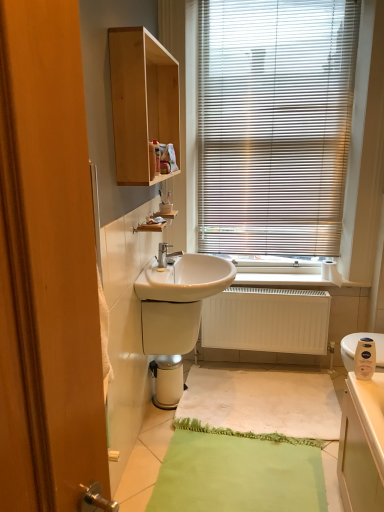
Question: Is matte plastic soap dispenser at lower right facing away from wooden cabinet at left?

Choices:
 (A) yes
 (B) no

Answer: (B)

Question: Is matte plastic soap dispenser at lower right far away from wooden cabinet at left?

Choices:
 (A) yes
 (B) no

Answer: (A)

Question: Does matte plastic soap dispenser at lower right appear on the left side of wooden cabinet at left?

Choices:
 (A) no
 (B) yes

Answer: (A)

Question: From a real-world perspective, is matte plastic soap dispenser at lower right on top of wooden cabinet at left?

Choices:
 (A) no
 (B) yes

Answer: (A)

Question: Does matte plastic soap dispenser at lower right have a greater height compared to wooden cabinet at left?

Choices:
 (A) yes
 (B) no

Answer: (B)

Question: Is matte plastic soap dispenser at lower right bigger or smaller than white matte radiator at lower center?

Choices:
 (A) big
 (B) small

Answer: (B)

Question: In the image, is matte plastic soap dispenser at lower right on the left side or the right side of white matte radiator at lower center?

Choices:
 (A) left
 (B) right

Answer: (B)

Question: From a real-world perspective, is matte plastic soap dispenser at lower right physically located above or below white matte radiator at lower center?

Choices:
 (A) below
 (B) above

Answer: (B)

Question: Is matte plastic soap dispenser at lower right taller or shorter than white matte radiator at lower center?

Choices:
 (A) short
 (B) tall

Answer: (A)

Question: Would you say matte plastic soap dispenser at lower right is to the left or to the right of white matte toilet paper at right in the picture?

Choices:
 (A) right
 (B) left

Answer: (B)

Question: In terms of height, does matte plastic soap dispenser at lower right look taller or shorter compared to white matte toilet paper at right?

Choices:
 (A) short
 (B) tall

Answer: (B)

Question: Considering the positions of matte plastic soap dispenser at lower right and white matte toilet paper at right in the image, is matte plastic soap dispenser at lower right bigger or smaller than white matte toilet paper at right?

Choices:
 (A) small
 (B) big

Answer: (A)

Question: From the image's perspective, is matte plastic soap dispenser at lower right above or below white matte toilet paper at right?

Choices:
 (A) below
 (B) above

Answer: (A)

Question: Is matte plastic soap dispenser at lower right bigger or smaller than white fabric bath mat at center?

Choices:
 (A) big
 (B) small

Answer: (B)

Question: In the image, is matte plastic soap dispenser at lower right positioned in front of or behind white fabric bath mat at center?

Choices:
 (A) behind
 (B) front

Answer: (B)